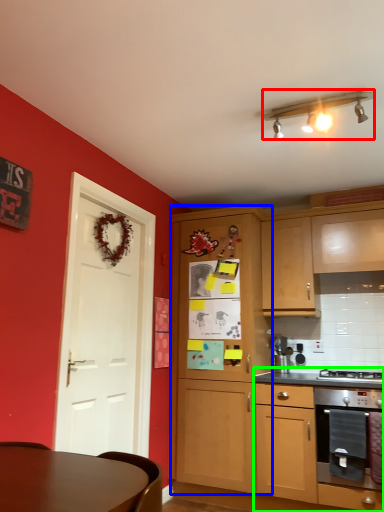
Question: Which is nearer to the lamp (highlighted by a red box)? cabinetry (highlighted by a blue box) or cabinetry (highlighted by a green box).

Choices:
 (A) cabinetry
 (B) cabinetry

Answer: (A)